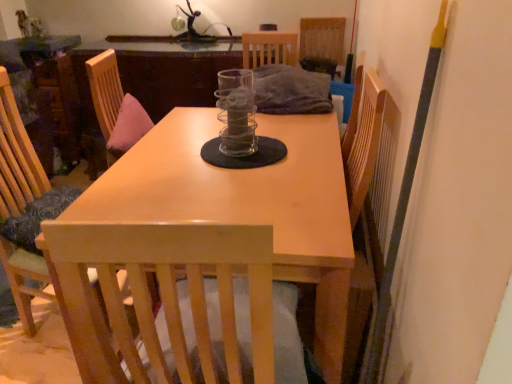
Question: Does clear glass jar at center have a greater height compared to wooden chair at left, the 2th chair when ordered from top to bottom?

Choices:
 (A) no
 (B) yes

Answer: (A)

Question: Is clear glass jar at center shorter than wooden chair at left, arranged as the first chair when viewed from the front?

Choices:
 (A) no
 (B) yes

Answer: (B)

Question: Does clear glass jar at center have a larger size compared to wooden chair at left, which is the first chair from bottom to top?

Choices:
 (A) no
 (B) yes

Answer: (A)

Question: Can you confirm if clear glass jar at center is positioned to the right of wooden chair at left, which is the first chair from bottom to top?

Choices:
 (A) yes
 (B) no

Answer: (A)

Question: Is the surface of clear glass jar at center in direct contact with wooden chair at left, the 2th chair when ordered from top to bottom?

Choices:
 (A) yes
 (B) no

Answer: (B)

Question: In the image, is metallic glass sculpture at upper center on the left side or the right side of woven fabric chair at upper center, which is the second chair in bottom-to-top order?

Choices:
 (A) left
 (B) right

Answer: (A)

Question: Does point (188, 41) appear closer or farther from the camera than point (310, 34)?

Choices:
 (A) closer
 (B) farther

Answer: (B)

Question: In the image, is metallic glass sculpture at upper center positioned in front of or behind woven fabric chair at upper center, which is the second chair in bottom-to-top order?

Choices:
 (A) behind
 (B) front

Answer: (A)

Question: Considering the positions of metallic glass sculpture at upper center and woven fabric chair at upper center, the first chair in the right-to-left sequence, in the image, is metallic glass sculpture at upper center taller or shorter than woven fabric chair at upper center, the first chair in the right-to-left sequence,?

Choices:
 (A) short
 (B) tall

Answer: (A)

Question: In terms of size, does wooden chair at left, marked as the second chair in a right-to-left arrangement, appear bigger or smaller than woven fabric chair at upper center, which is the second chair in front-to-back order?

Choices:
 (A) small
 (B) big

Answer: (B)

Question: Would you say wooden chair at left, arranged as the first chair when viewed from the front, is to the left or to the right of woven fabric chair at upper center, the 2th chair from the left, in the picture?

Choices:
 (A) right
 (B) left

Answer: (B)

Question: In the image, is wooden chair at left, placed as the 2th chair when sorted from back to front, positioned in front of or behind woven fabric chair at upper center, which is the second chair in bottom-to-top order?

Choices:
 (A) behind
 (B) front

Answer: (B)

Question: From a real-world perspective, is wooden chair at left, placed as the 2th chair when sorted from back to front, positioned above or below woven fabric chair at upper center, which is the second chair in front-to-back order?

Choices:
 (A) below
 (B) above

Answer: (A)

Question: From a real-world perspective, is clear glass jar at center positioned above or below metallic glass sculpture at upper center?

Choices:
 (A) above
 (B) below

Answer: (B)

Question: In the image, is clear glass jar at center on the left side or the right side of metallic glass sculpture at upper center?

Choices:
 (A) left
 (B) right

Answer: (B)